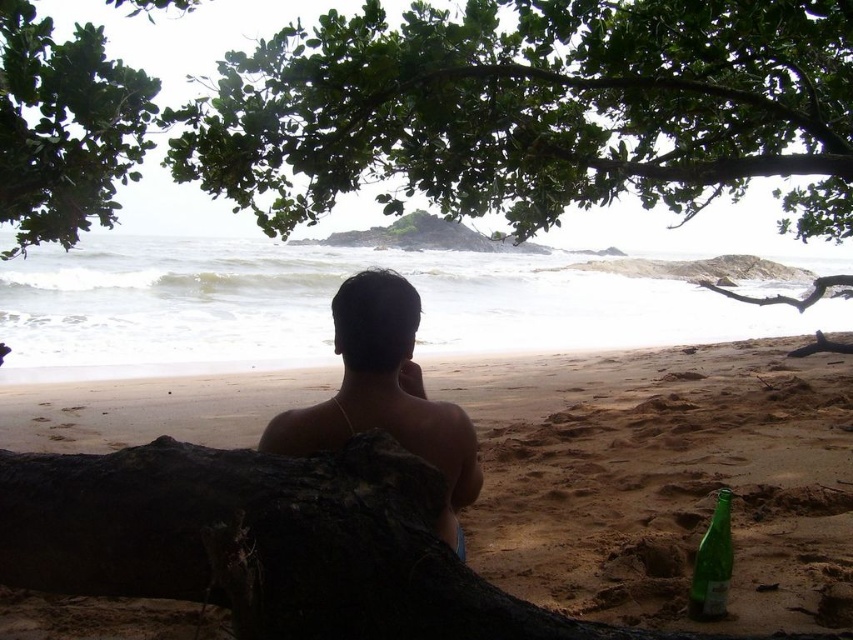
You are standing at the edge of the beach looking towards the ocean. You see the sandy yellow at lower center and the green leafy tree at upper left. Which object is closer to your right side?

The sandy yellow at lower center is to the right of green leafy tree at upper left, so the sandy yellow at lower center is closer to your right side.

You are standing at the sandy yellow at lower center and want to walk towards the green leafy tree at upper left. Which direction should you move to get closer to the tree?

You should move towards the upper left direction to get closer to the green leafy tree at upper left since it is located at upper left and the sandy yellow at lower center is lower in height compared to it.